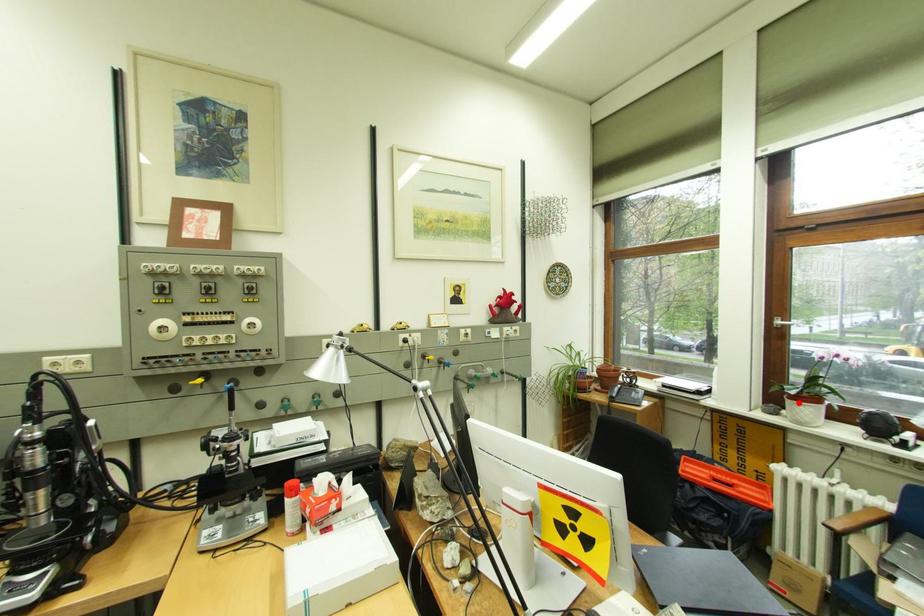
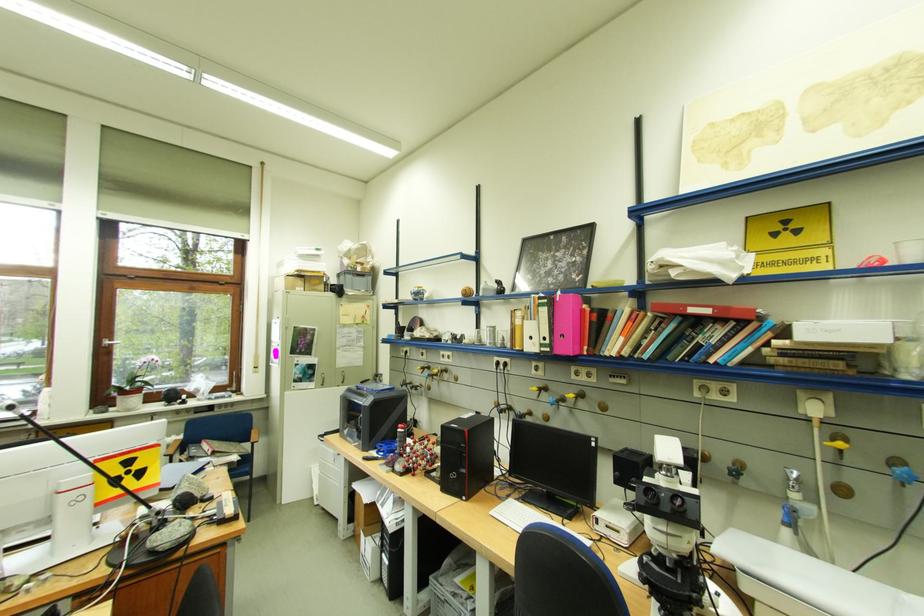
Question: I am providing you with two images of the same scene from different viewpoints. A red point is marked on the first image. At the location where the point appears in image 1, is it still visible in image 2?

Choices:
 (A) Yes
 (B) No

Answer: (A)